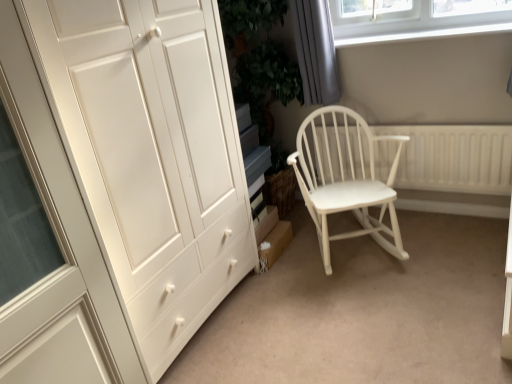
Question: From the image's perspective, is gray fabric curtain at upper right below white wood rocking chair at center?

Choices:
 (A) yes
 (B) no

Answer: (B)

Question: Is gray fabric curtain at upper right with white wood rocking chair at center?

Choices:
 (A) yes
 (B) no

Answer: (B)

Question: Considering the relative sizes of gray fabric curtain at upper right and white wood rocking chair at center in the image provided, is gray fabric curtain at upper right bigger than white wood rocking chair at center?

Choices:
 (A) yes
 (B) no

Answer: (B)

Question: From a real-world perspective, is gray fabric curtain at upper right below white wood rocking chair at center?

Choices:
 (A) no
 (B) yes

Answer: (A)

Question: Does gray fabric curtain at upper right have a smaller size compared to white wood rocking chair at center?

Choices:
 (A) no
 (B) yes

Answer: (B)

Question: Would you say matte white wardrobe at left is to the left or to the right of white textured radiator at right in the picture?

Choices:
 (A) right
 (B) left

Answer: (B)

Question: From their relative heights in the image, would you say matte white wardrobe at left is taller or shorter than white textured radiator at right?

Choices:
 (A) tall
 (B) short

Answer: (A)

Question: Considering their positions, is matte white wardrobe at left located in front of or behind white textured radiator at right?

Choices:
 (A) behind
 (B) front

Answer: (B)

Question: Does point (78, 62) appear closer or farther from the camera than point (400, 185)?

Choices:
 (A) closer
 (B) farther

Answer: (A)

Question: From a real-world perspective, relative to white plastic window sill at upper right, is white wood rocking chair at center vertically above or below?

Choices:
 (A) below
 (B) above

Answer: (A)

Question: Is point (333, 152) closer or farther from the camera than point (418, 39)?

Choices:
 (A) farther
 (B) closer

Answer: (A)

Question: Visually, is white wood rocking chair at center positioned to the left or to the right of white plastic window sill at upper right?

Choices:
 (A) right
 (B) left

Answer: (B)

Question: Relative to white plastic window sill at upper right, is white wood rocking chair at center in front or behind?

Choices:
 (A) behind
 (B) front

Answer: (B)

Question: From the image's perspective, is white textured radiator at right located above or below matte white wardrobe at left?

Choices:
 (A) below
 (B) above

Answer: (B)

Question: Relative to matte white wardrobe at left, is white textured radiator at right in front or behind?

Choices:
 (A) front
 (B) behind

Answer: (B)